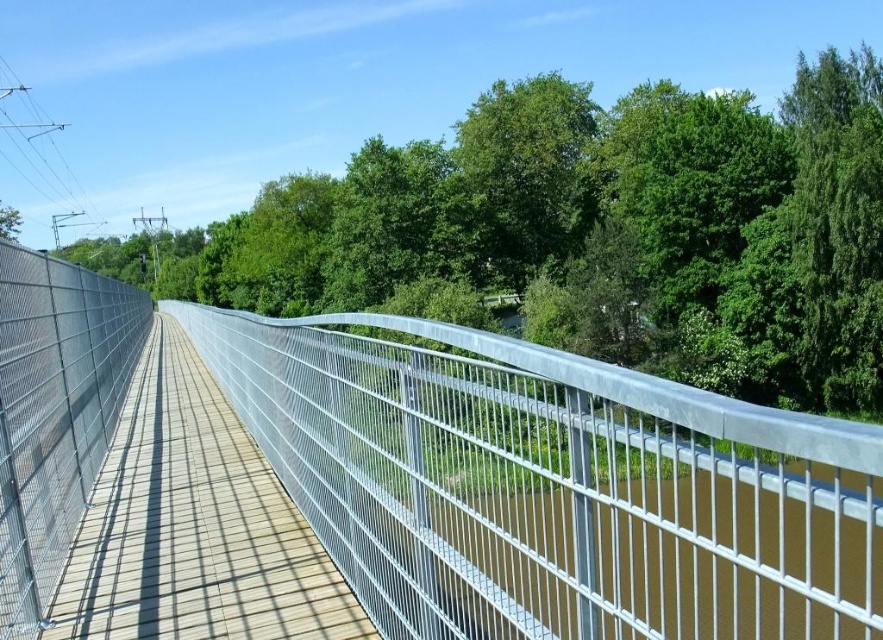
Looking at this image, you are standing on the wooden deck of the pedestrian bridge and looking towards the center. Which object is closer to you between the silver metallic fence at center and the green leafy tree at upper center?

The silver metallic fence at center is closer to you as it is positioned in front of the green leafy tree at upper center.